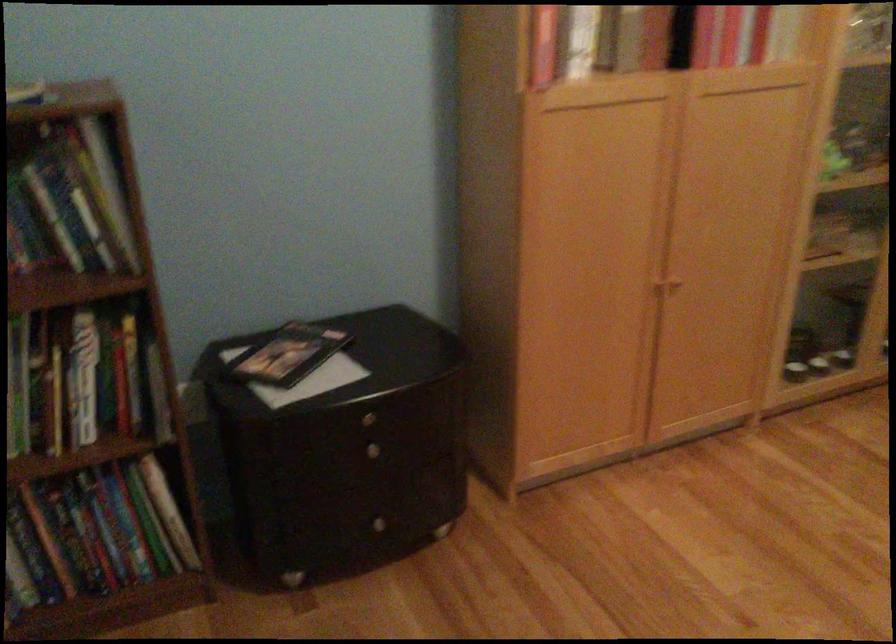
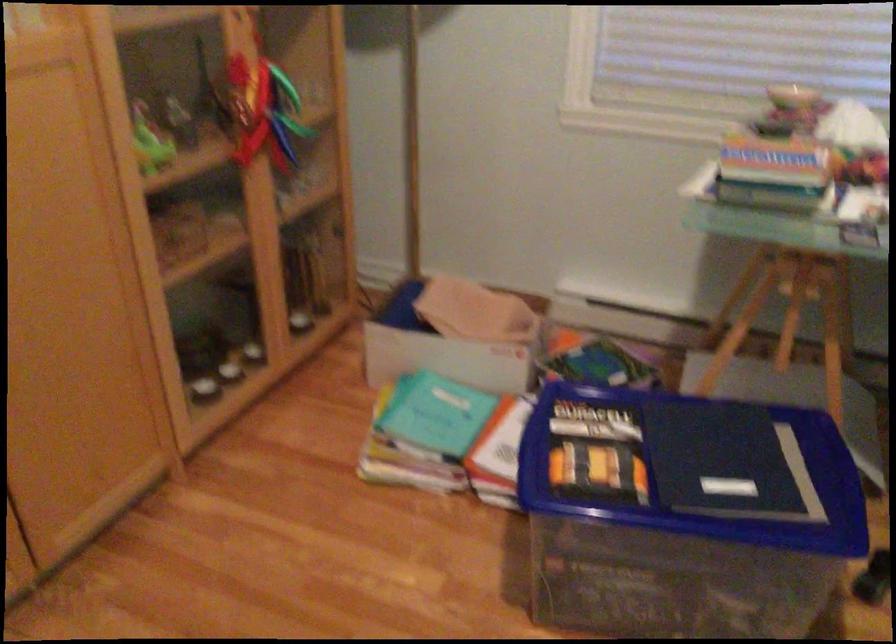
Question: The images are taken continuously from a first-person perspective. In which direction is your viewpoint rotating?

Choices:
 (A) Left
 (B) Right
 (C) Up
 (D) Down

Answer: (B)